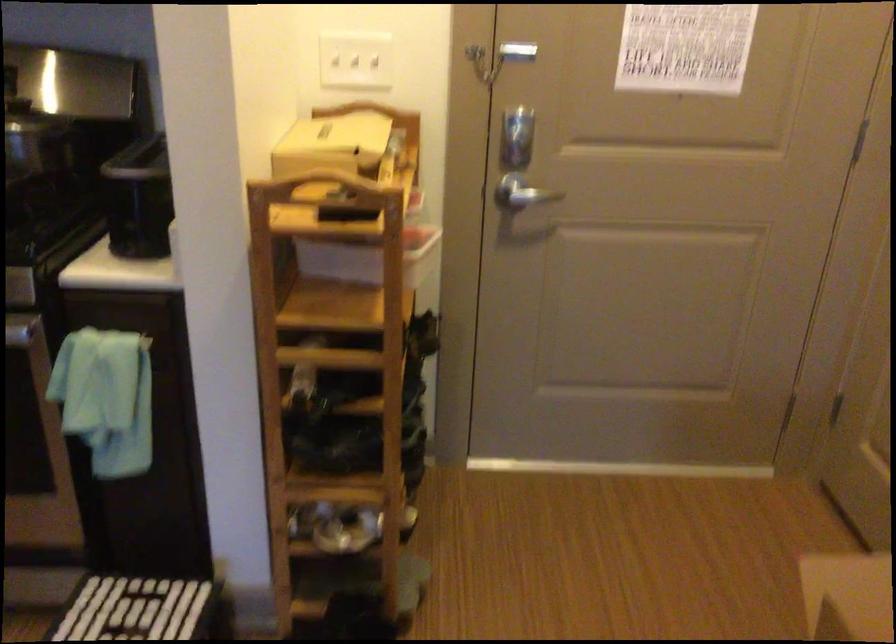
Locate an element on the screen. black shoe is located at coordinates (355, 442).